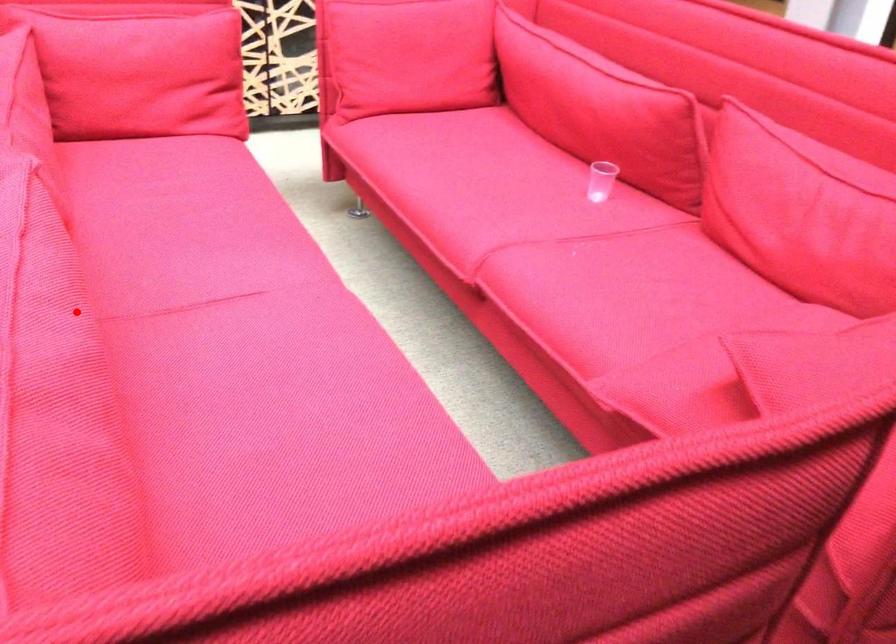
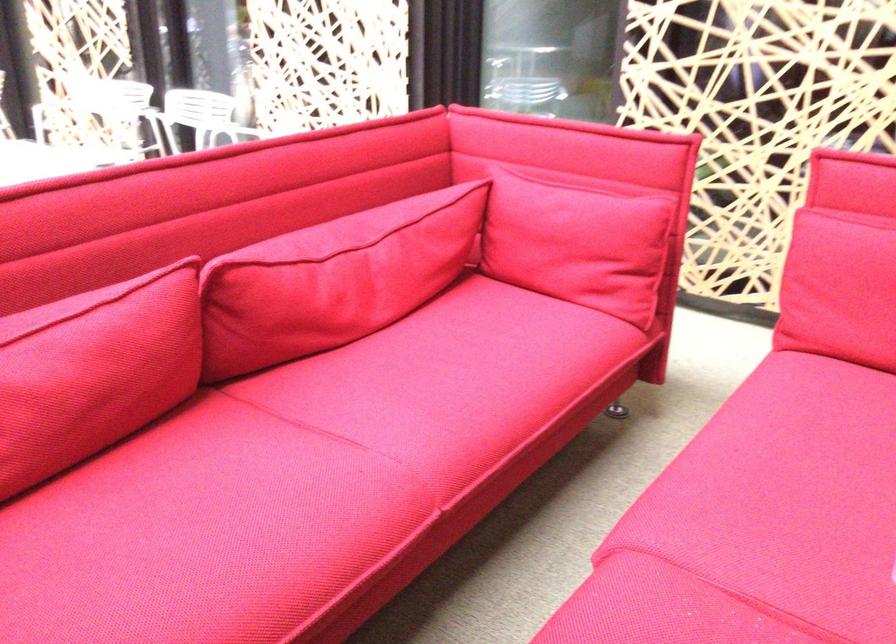
Question: A red point is marked in image1. In image2, is the corresponding 3D point closer to the camera or farther? Reply with the corresponding letter.

Choices:
 (A) The corresponding 3D point is closer.
 (B) The corresponding 3D point is farther.

Answer: (B)